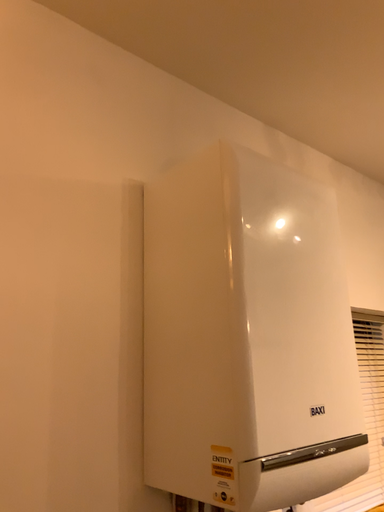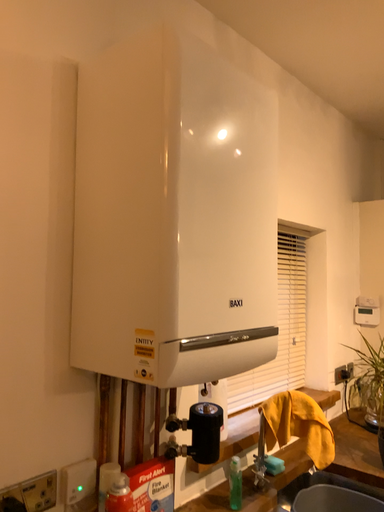
Question: Which way did the camera rotate in the video?

Choices:
 (A) rotated upward
 (B) rotated downward

Answer: (B)